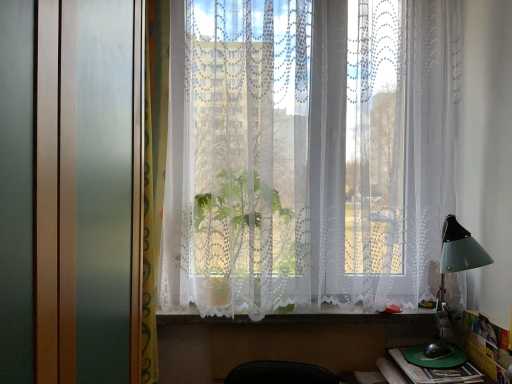
Identify the location of blank space situated above green plastic book at lower right (from a real-world perspective). This screenshot has height=384, width=512. (438, 365).